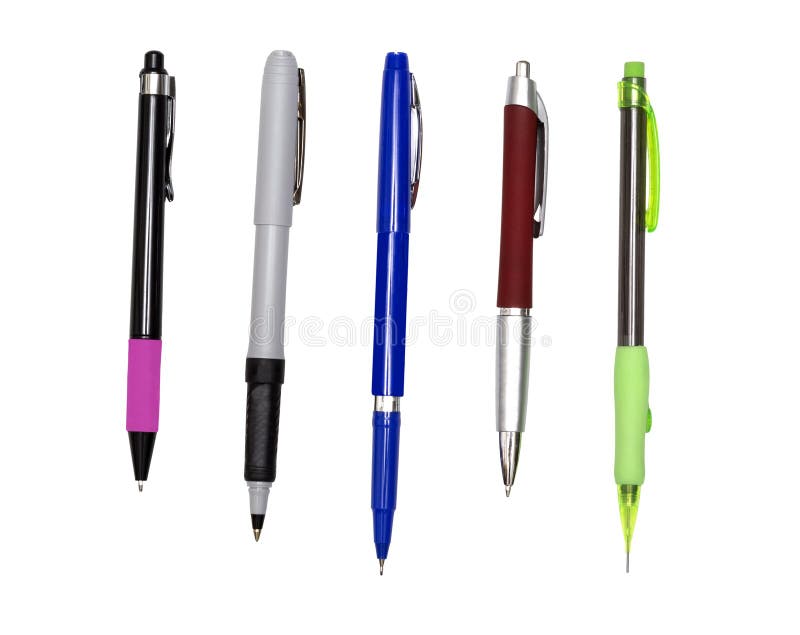
You are a GUI agent. You are given a task and a screenshot of the screen. Output one action in this format:
    pyautogui.click(x=<x>, y=<y>)
    Task: Click on the pens
    The image size is (800, 635).
    Given the screenshot: What is the action you would take?
    click(150, 236), click(266, 268), click(394, 286), click(513, 260), click(632, 279)